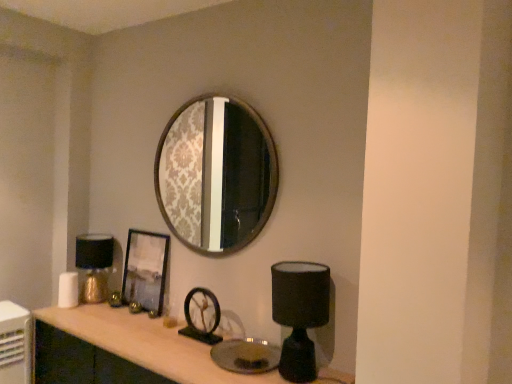
Question: Is matte wood computer desk at center positioned behind metallic silver picture frame at center?

Choices:
 (A) no
 (B) yes

Answer: (A)

Question: Considering the relative sizes of matte wood computer desk at center and metallic silver picture frame at center in the image provided, is matte wood computer desk at center smaller than metallic silver picture frame at center?

Choices:
 (A) yes
 (B) no

Answer: (B)

Question: Is matte wood computer desk at center wider than metallic silver picture frame at center?

Choices:
 (A) yes
 (B) no

Answer: (A)

Question: Could you tell me if matte wood computer desk at center is turned towards metallic silver picture frame at center?

Choices:
 (A) yes
 (B) no

Answer: (B)

Question: Is matte wood computer desk at center at the right side of metallic silver picture frame at center?

Choices:
 (A) no
 (B) yes

Answer: (B)

Question: Is matte wood computer desk at center wider or thinner than black matte table lamp at lower right, acting as the first table lamp starting from the right?

Choices:
 (A) thin
 (B) wide

Answer: (B)

Question: Is point (172, 360) positioned closer to the camera than point (288, 261)?

Choices:
 (A) closer
 (B) farther

Answer: (A)

Question: From a real-world perspective, is matte wood computer desk at center physically located above or below black matte table lamp at lower right, placed as the 1th table lamp when sorted from front to back?

Choices:
 (A) above
 (B) below

Answer: (B)

Question: Looking at the image, does matte wood computer desk at center seem bigger or smaller compared to black matte table lamp at lower right, the 2th table lamp in the left-to-right sequence?

Choices:
 (A) small
 (B) big

Answer: (B)

Question: From a real-world perspective, is metallic silver picture frame at center physically located above or below black matte table lamp at lower right, placed as the 1th table lamp when sorted from front to back?

Choices:
 (A) below
 (B) above

Answer: (A)

Question: Considering the relative positions of metallic silver picture frame at center and black matte table lamp at lower right, the 2th table lamp in the left-to-right sequence, in the image provided, is metallic silver picture frame at center to the left or to the right of black matte table lamp at lower right, the 2th table lamp in the left-to-right sequence,?

Choices:
 (A) right
 (B) left

Answer: (B)

Question: Which is correct: metallic silver picture frame at center is inside black matte table lamp at lower right, the 2th table lamp in the left-to-right sequence, or outside of it?

Choices:
 (A) inside
 (B) outside

Answer: (B)

Question: Considering the positions of metallic silver picture frame at center and black matte table lamp at lower right, placed as the 1th table lamp when sorted from front to back, in the image, is metallic silver picture frame at center taller or shorter than black matte table lamp at lower right, placed as the 1th table lamp when sorted from front to back,?

Choices:
 (A) short
 (B) tall

Answer: (B)

Question: Which is correct: black matte table lamp at lower right, placed as the 1th table lamp when sorted from front to back, is inside metallic silver picture frame at center, or outside of it?

Choices:
 (A) outside
 (B) inside

Answer: (A)

Question: Considering the positions of black matte table lamp at lower right, placed as the 1th table lamp when sorted from front to back, and metallic silver picture frame at center in the image, is black matte table lamp at lower right, placed as the 1th table lamp when sorted from front to back, wider or thinner than metallic silver picture frame at center?

Choices:
 (A) wide
 (B) thin

Answer: (A)